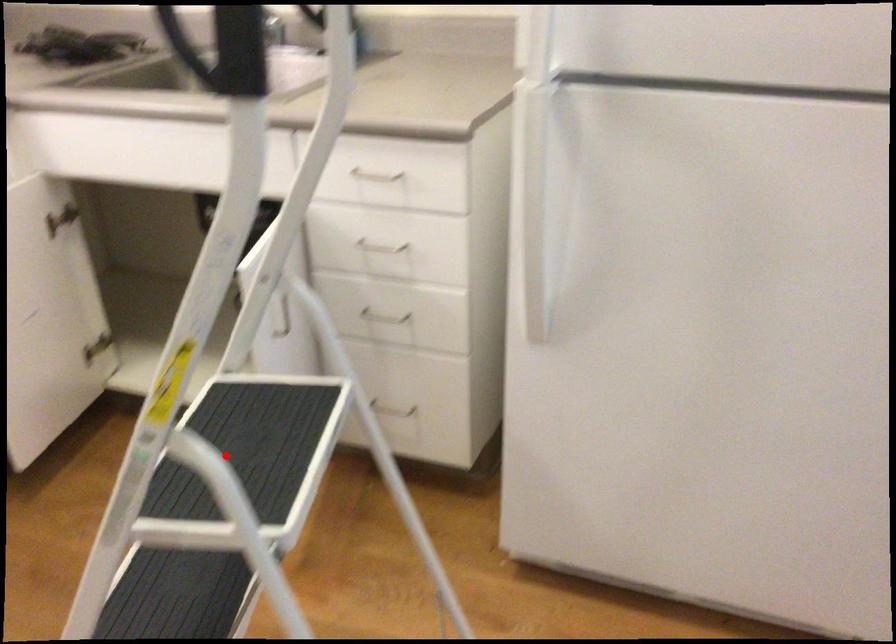
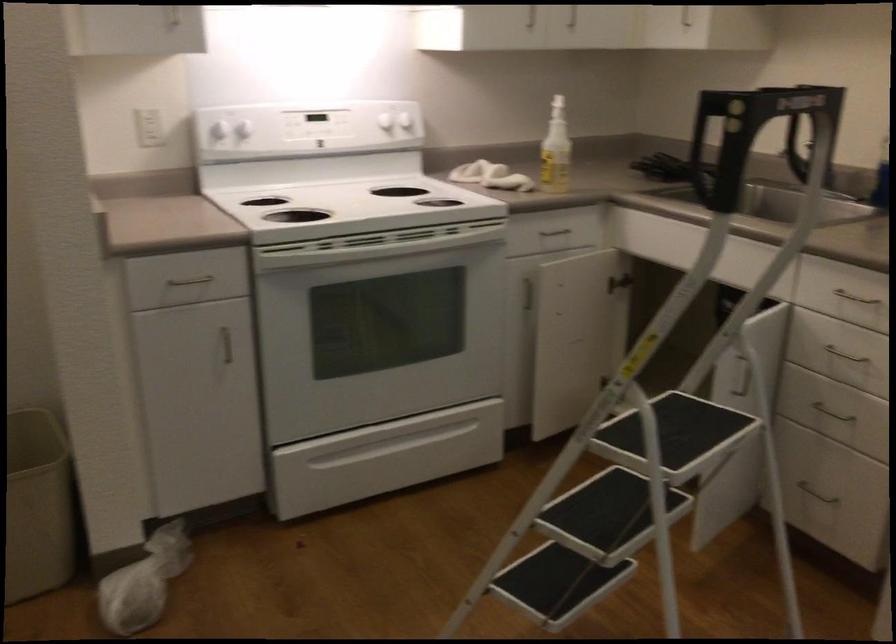
Question: A red point is marked in image1. In image2, is the corresponding 3D point closer to the camera or farther? Reply with the corresponding letter.

Choices:
 (A) The corresponding 3D point is closer.
 (B) The corresponding 3D point is farther.

Answer: (B)